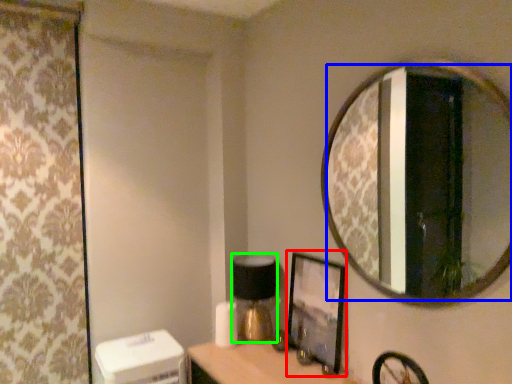
Question: Which object is positioned closest to picture frame (highlighted by a red box)? Select from mirror (highlighted by a blue box) and table lamp (highlighted by a green box).

Choices:
 (A) mirror
 (B) table lamp

Answer: (B)